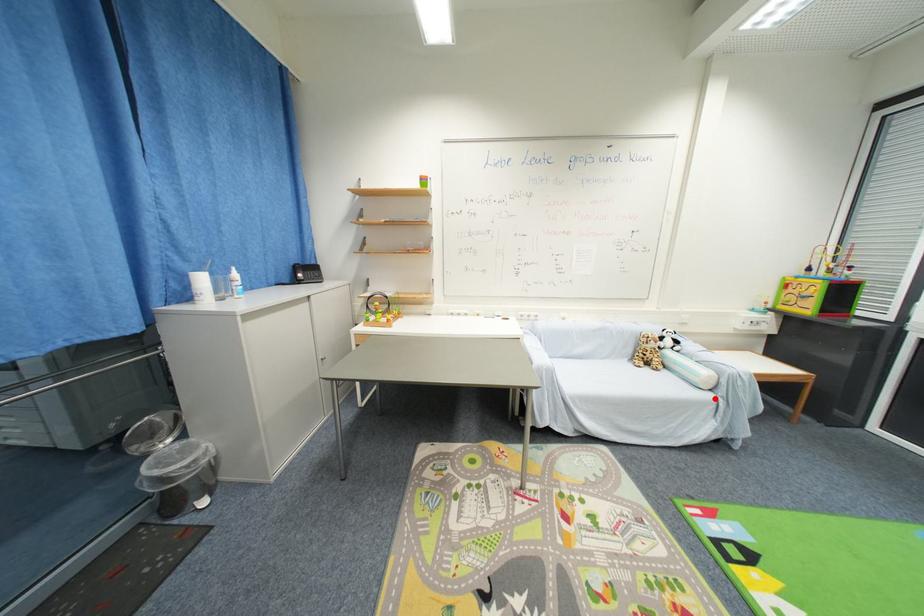
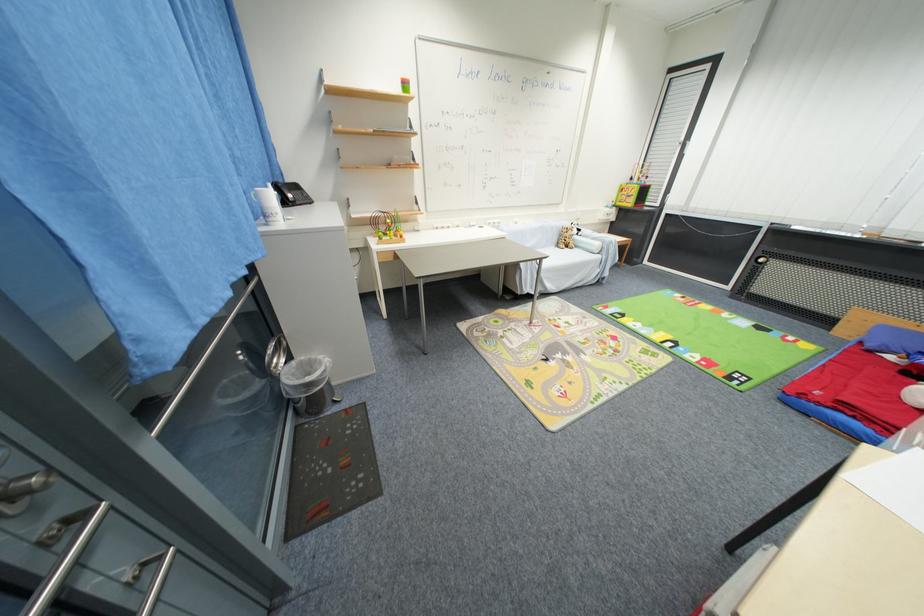
Question: I am providing you with two images of the same scene from different viewpoints. A red point is marked on the first image. Can you still see the location of the red point in image 2?

Choices:
 (A) Yes
 (B) No

Answer: (A)